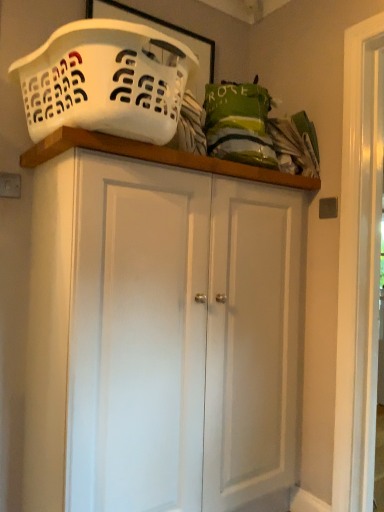
The height and width of the screenshot is (512, 384). I want to click on blank space above white matte cupboard at center (from a real-world perspective), so click(206, 156).